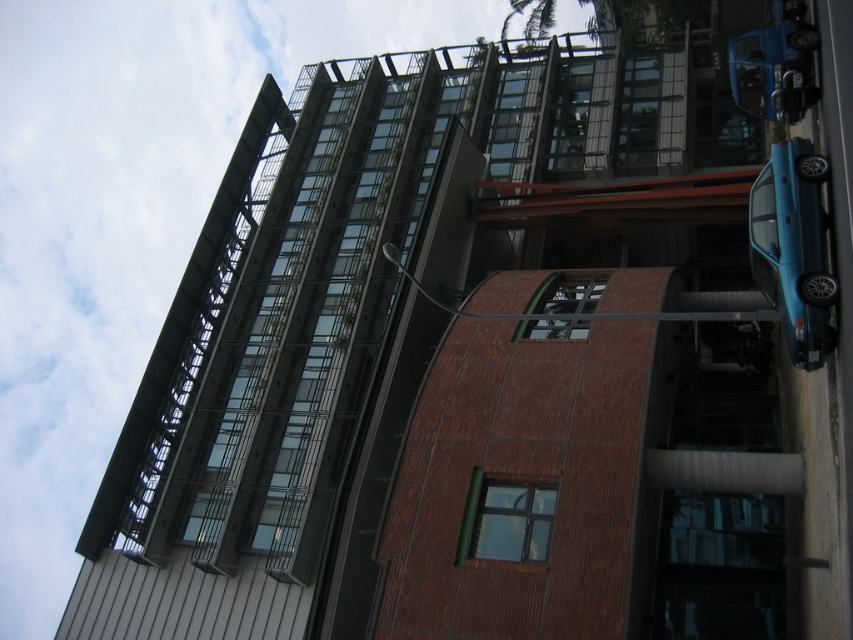
You are a delivery driver who needs to park your truck between the teal glossy car at right and the blue matte car at upper right. The truck requires a space of 8 meters. Is there enough space between them?

The distance between the teal glossy car at right and the blue matte car at upper right is 7.33 meters, which is less than the required 8 meters. Therefore, there is not enough space for the truck to park between them.